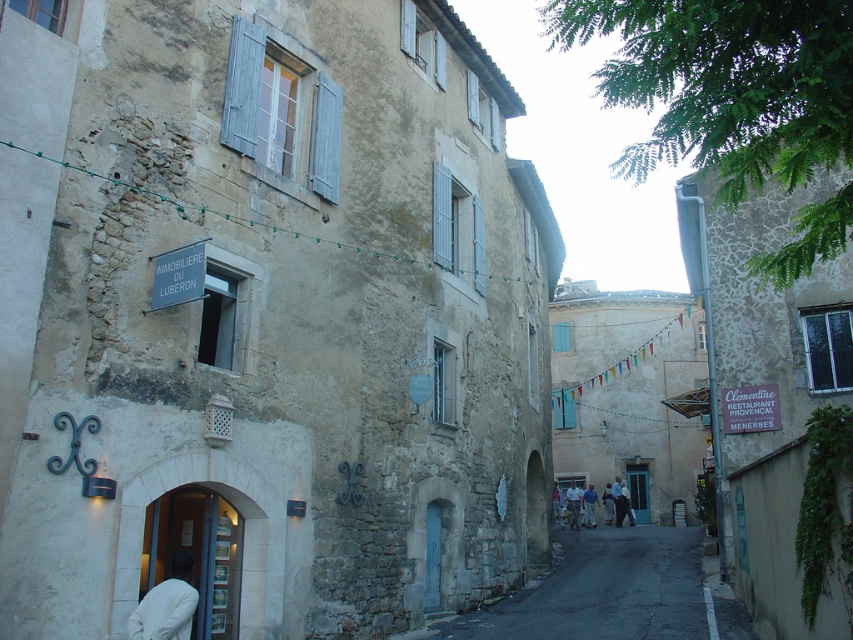
Question: Which point appears farthest from the camera in this image?

Choices:
 (A) (166, 616)
 (B) (570, 496)
 (C) (585, 524)

Answer: (C)

Question: Is dark asphalt road at center below white cloth at lower left?

Choices:
 (A) yes
 (B) no

Answer: (A)

Question: Is light blue shirt at center positioned at the back of blue cotton shirt at center?

Choices:
 (A) no
 (B) yes

Answer: (A)

Question: Which of the following is the closest to the observer?

Choices:
 (A) light blue shirt at center
 (B) blue cotton shirt at center

Answer: (A)

Question: Which of the following is the farthest from the observer?

Choices:
 (A) (686, 547)
 (B) (535, 227)
 (C) (177, 612)

Answer: (B)

Question: Does dark asphalt road at center lie in front of white cloth at lower left?

Choices:
 (A) yes
 (B) no

Answer: (B)